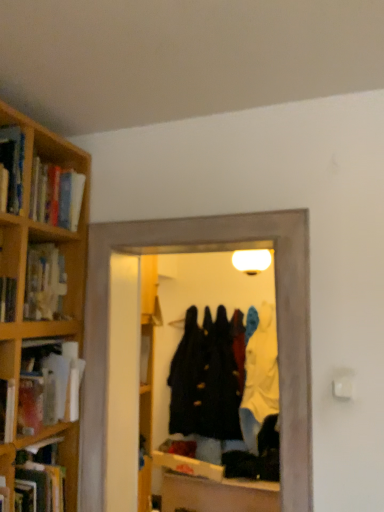
The height and width of the screenshot is (512, 384). What do you see at coordinates (277, 319) in the screenshot?
I see `transparent glass door at center` at bounding box center [277, 319].

This screenshot has height=512, width=384. What are the coordinates of `transparent glass door at center` in the screenshot? It's located at (277, 319).

The height and width of the screenshot is (512, 384). In order to click on wooden bookshelf at left in this screenshot , I will do `click(26, 269)`.

What do you see at coordinates (52, 389) in the screenshot?
I see `matte cardboard book at left, which is counted as the 1th book, starting from the top` at bounding box center [52, 389].

What is the approximate width of hardcover book at left, the second book positioned from the top?

hardcover book at left, the second book positioned from the top, is 36.65 centimeters wide.

The width and height of the screenshot is (384, 512). In order to click on transparent glass door at center in this screenshot , I will do `click(277, 319)`.

Does yellow fabric coat at center, which is counted as the first clothing, starting from the right, have a larger size compared to velvet black coat at center, arranged as the 2th clothing when viewed from the right?

Yes.

Is yellow fabric coat at center, which is counted as the first clothing, starting from the right, at the right side of velvet black coat at center, arranged as the 2th clothing when viewed from the right?

Indeed, yellow fabric coat at center, which is counted as the first clothing, starting from the right, is positioned on the right side of velvet black coat at center, arranged as the 2th clothing when viewed from the right.

Would you say velvet black coat at center, arranged as the 2th clothing when viewed from the right, is part of yellow fabric coat at center, which is counted as the first clothing, starting from the right,'s contents?

No, velvet black coat at center, arranged as the 2th clothing when viewed from the right, is not inside yellow fabric coat at center, which is counted as the first clothing, starting from the right.

From a real-world perspective, is yellow fabric coat at center, which is the 2th clothing in left-to-right order, below velvet black coat at center, which is counted as the 1th clothing, starting from the left?

Indeed, from a real-world perspective, yellow fabric coat at center, which is the 2th clothing in left-to-right order, is positioned beneath velvet black coat at center, which is counted as the 1th clothing, starting from the left.

Is wooden bookshelf at left at the left side of velvet black coat at center, which is counted as the 1th clothing, starting from the left?

Indeed, wooden bookshelf at left is positioned on the left side of velvet black coat at center, which is counted as the 1th clothing, starting from the left.

Would you say wooden bookshelf at left is a long distance from velvet black coat at center, arranged as the 2th clothing when viewed from the right?

Yes, wooden bookshelf at left and velvet black coat at center, arranged as the 2th clothing when viewed from the right, are located far from each other.

Is wooden bookshelf at left outside of velvet black coat at center, arranged as the 2th clothing when viewed from the right?

That's correct, wooden bookshelf at left is outside of velvet black coat at center, arranged as the 2th clothing when viewed from the right.

From the image's perspective, relative to velvet black coat at center, which is counted as the 1th clothing, starting from the left, is wooden bookshelf at left above or below?

Based on their image positions, wooden bookshelf at left is located above velvet black coat at center, which is counted as the 1th clothing, starting from the left.

Locate an element on the screen. This screenshot has width=384, height=512. clothing above the yellow fabric coat at center, which is counted as the first clothing, starting from the right (from the image's perspective) is located at coordinates (205, 380).

Based on the photo, is velvet black coat at center, arranged as the 2th clothing when viewed from the right, oriented away from yellow fabric coat at center, which is counted as the first clothing, starting from the right?

velvet black coat at center, arranged as the 2th clothing when viewed from the right, is not turned away from yellow fabric coat at center, which is counted as the first clothing, starting from the right.

Are velvet black coat at center, which is counted as the 1th clothing, starting from the left, and yellow fabric coat at center, which is counted as the first clothing, starting from the right, beside each other?

No, velvet black coat at center, which is counted as the 1th clothing, starting from the left, is not next to yellow fabric coat at center, which is counted as the first clothing, starting from the right.

Consider the image. In terms of height, does velvet black coat at center, arranged as the 2th clothing when viewed from the right, look taller or shorter compared to yellow fabric coat at center, which is the 2th clothing in left-to-right order?

Considering their sizes, velvet black coat at center, arranged as the 2th clothing when viewed from the right, has less height than yellow fabric coat at center, which is the 2th clothing in left-to-right order.

From the image's perspective, is yellow fabric coat at center, which is the 2th clothing in left-to-right order, positioned above or below transparent glass door at center?

yellow fabric coat at center, which is the 2th clothing in left-to-right order, is below transparent glass door at center.

Consider the image. Is yellow fabric coat at center, which is counted as the first clothing, starting from the right, far away from transparent glass door at center?

Yes, yellow fabric coat at center, which is counted as the first clothing, starting from the right, and transparent glass door at center are quite far apart.

Who is shorter, yellow fabric coat at center, which is counted as the first clothing, starting from the right, or transparent glass door at center?

transparent glass door at center.

Between point (266, 334) and point (277, 272), which one is positioned behind?

The point (266, 334) is behind.

In order to click on cabinet located behind the matte cardboard book at left, which appears as the second book when ordered from the bottom in this screenshot , I will do `click(26, 269)`.

In the scene shown: Which is less distant, (67, 234) or (33, 426)?

Point (67, 234) appears to be farther away from the viewer than point (33, 426).

From the picture: Is matte cardboard book at left, which appears as the second book when ordered from the bottom, completely or partially inside wooden bookshelf at left?

Actually, matte cardboard book at left, which appears as the second book when ordered from the bottom, is outside wooden bookshelf at left.

Is hardcover book at left, the second book positioned from the top, taller or shorter than matte cardboard book at left, which is counted as the 1th book, starting from the top?

hardcover book at left, the second book positioned from the top, is shorter than matte cardboard book at left, which is counted as the 1th book, starting from the top.

Is hardcover book at left, the second book positioned from the top, with matte cardboard book at left, which appears as the second book when ordered from the bottom?

No, hardcover book at left, the second book positioned from the top, is not touching matte cardboard book at left, which appears as the second book when ordered from the bottom.

Considering their positions, is hardcover book at left, the second book positioned from the top, located in front of or behind matte cardboard book at left, which appears as the second book when ordered from the bottom?

Clearly, hardcover book at left, the second book positioned from the top, is in front of matte cardboard book at left, which appears as the second book when ordered from the bottom.

Does point (35, 464) appear closer or farther from the camera than point (67, 347)?

Clearly, point (35, 464) is closer to the camera than point (67, 347).

Which is behind, point (194, 320) or point (90, 321)?

Point (194, 320)

Considering the relative sizes of velvet black coat at center, which is counted as the 1th clothing, starting from the left, and transparent glass door at center in the image provided, is velvet black coat at center, which is counted as the 1th clothing, starting from the left, bigger than transparent glass door at center?

Correct, velvet black coat at center, which is counted as the 1th clothing, starting from the left, is larger in size than transparent glass door at center.

From a real-world perspective, is velvet black coat at center, arranged as the 2th clothing when viewed from the right, positioned over transparent glass door at center based on gravity?

No.

Is transparent glass door at center at the back of velvet black coat at center, arranged as the 2th clothing when viewed from the right?

No, velvet black coat at center, arranged as the 2th clothing when viewed from the right, is not facing away from transparent glass door at center.

Where is `clothing on the left of yellow fabric coat at center, which is the 2th clothing in left-to-right order`? The width and height of the screenshot is (384, 512). clothing on the left of yellow fabric coat at center, which is the 2th clothing in left-to-right order is located at coordinates (205, 380).

From the image's perspective, count 1st clothings downward from the wooden bookshelf at left and point to it. Please provide its 2D coordinates.

[(205, 380)]

Considering their positions, is velvet black coat at center, which is counted as the 1th clothing, starting from the left, positioned further to transparent glass door at center than matte cardboard book at left, which is counted as the 1th book, starting from the top?

Among the two, velvet black coat at center, which is counted as the 1th clothing, starting from the left, is located further to transparent glass door at center.

Estimate the real-world distances between objects in this image. Which object is closer to matte cardboard book at left, which appears as the second book when ordered from the bottom, yellow fabric coat at center, which is the 2th clothing in left-to-right order, or hardcover book at left, which is counted as the first book, starting from the bottom?

hardcover book at left, which is counted as the first book, starting from the bottom.

In the scene shown: From the image, which object appears to be farther from transparent glass door at center, velvet black coat at center, arranged as the 2th clothing when viewed from the right, or yellow fabric coat at center, which is the 2th clothing in left-to-right order?

velvet black coat at center, arranged as the 2th clothing when viewed from the right, is further to transparent glass door at center.

Considering their positions, is transparent glass door at center positioned closer to velvet black coat at center, which is counted as the 1th clothing, starting from the left, than matte cardboard book at left, which appears as the second book when ordered from the bottom?

transparent glass door at center is positioned closer to the anchor velvet black coat at center, which is counted as the 1th clothing, starting from the left.

Considering their positions, is yellow fabric coat at center, which is the 2th clothing in left-to-right order, positioned closer to wooden bookshelf at left than velvet black coat at center, arranged as the 2th clothing when viewed from the right?

yellow fabric coat at center, which is the 2th clothing in left-to-right order, is positioned closer to the anchor wooden bookshelf at left.

Based on their spatial positions, is matte cardboard book at left, which appears as the second book when ordered from the bottom, or wooden bookshelf at left closer to velvet black coat at center, which is counted as the 1th clothing, starting from the left?

matte cardboard book at left, which appears as the second book when ordered from the bottom, lies closer to velvet black coat at center, which is counted as the 1th clothing, starting from the left, than the other object.

Based on their spatial positions, is transparent glass door at center or matte cardboard book at left, which is counted as the 1th book, starting from the top, further from wooden bookshelf at left?

transparent glass door at center lies further to wooden bookshelf at left than the other object.

Estimate the real-world distances between objects in this image. Which object is closer to transparent glass door at center, wooden bookshelf at left or yellow fabric coat at center, which is counted as the first clothing, starting from the right?

wooden bookshelf at left.

Where is `book located between hardcover book at left, which is counted as the first book, starting from the bottom, and velvet black coat at center, arranged as the 2th clothing when viewed from the right, in the depth direction`? This screenshot has height=512, width=384. book located between hardcover book at left, which is counted as the first book, starting from the bottom, and velvet black coat at center, arranged as the 2th clothing when viewed from the right, in the depth direction is located at coordinates (52, 389).

Where is `glass door between wooden bookshelf at left and hardcover book at left, the second book positioned from the top, from top to bottom`? This screenshot has width=384, height=512. glass door between wooden bookshelf at left and hardcover book at left, the second book positioned from the top, from top to bottom is located at coordinates (277, 319).

Find the location of `book situated between hardcover book at left, the second book positioned from the top, and transparent glass door at center from left to right`. book situated between hardcover book at left, the second book positioned from the top, and transparent glass door at center from left to right is located at coordinates (52, 389).

This screenshot has width=384, height=512. I want to click on clothing positioned between wooden bookshelf at left and velvet black coat at center, arranged as the 2th clothing when viewed from the right, from near to far, so click(260, 378).